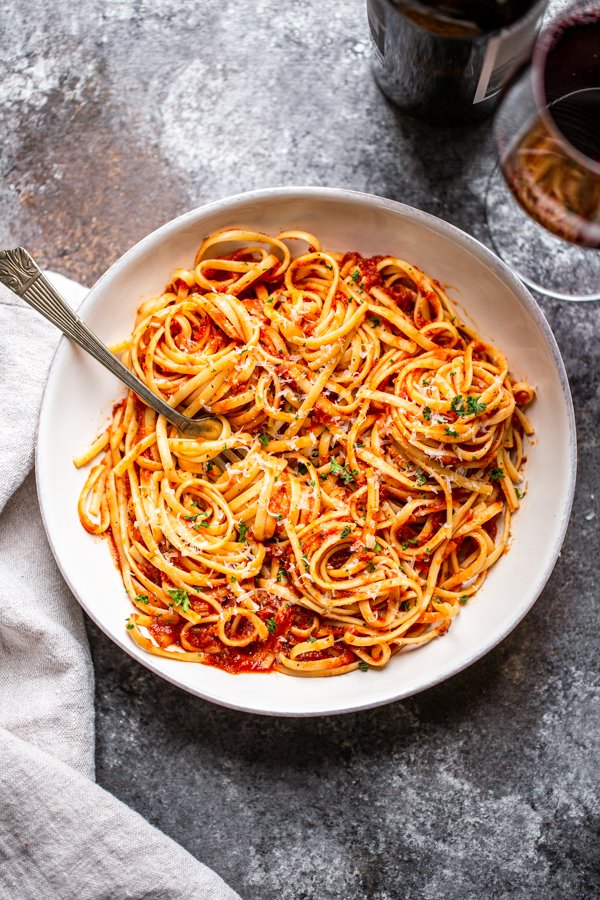
At what (x,y) coordinates should I click in order to perform the action: click on countertop. Please return your answer as a coordinate pair (x, y). This screenshot has height=900, width=600. Looking at the image, I should click on (346, 794).